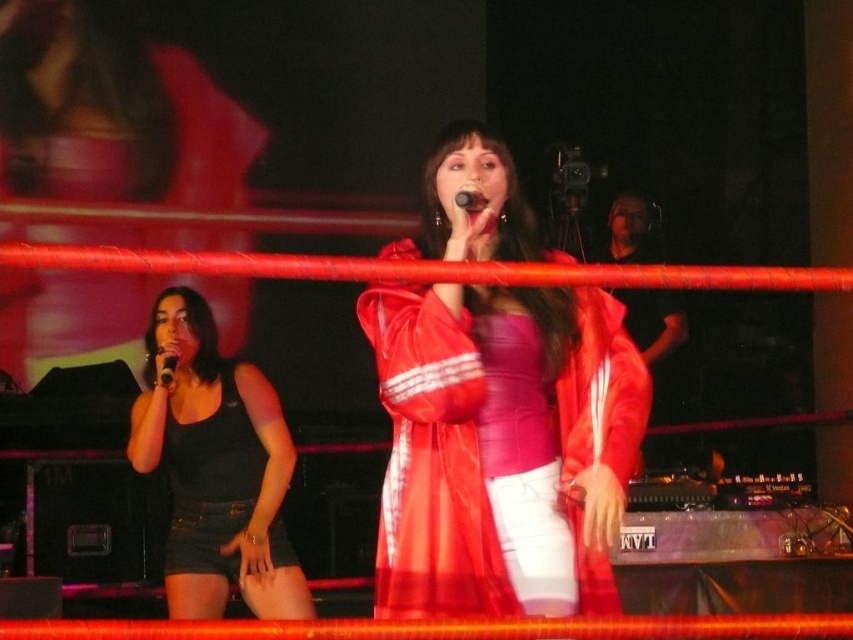
You are a photographer at the event and want to capture a clear shot of both the black matte tank top at left and the black matte microphone at left. Since the tank top is wider than the microphone, which object should you focus on to ensure both are in frame without cropping?

Since the black matte tank top at left is wider than the black matte microphone at left, you should focus on the black matte tank top at left to ensure both are in frame without cropping.

You are a stage technician checking the microphones before the performance. You notice two microphones on stage. The black matte microphone at left and the black plastic microphone at center. Which one has a wider grip area?

The black matte microphone at left has a wider grip area than the black plastic microphone at center because the black matte microphone at left is wider in width.